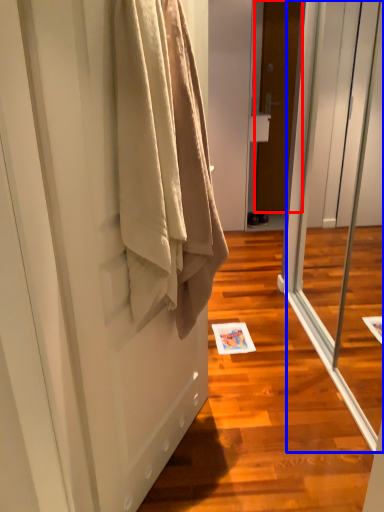
Question: Which object appears farthest to the camera in this image, door (highlighted by a red box) or screen door (highlighted by a blue box)?

Choices:
 (A) door
 (B) screen door

Answer: (A)